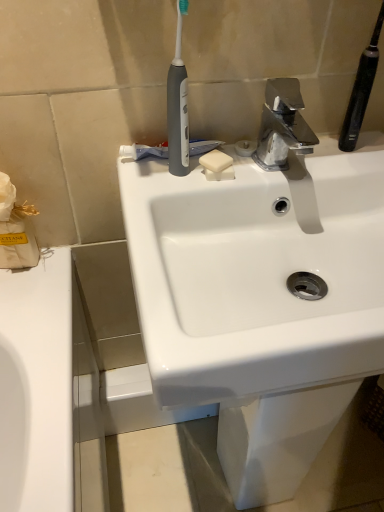
Where is `vacant area that is situated to the right of polished chrome faucet at upper center`? vacant area that is situated to the right of polished chrome faucet at upper center is located at coordinates (343, 158).